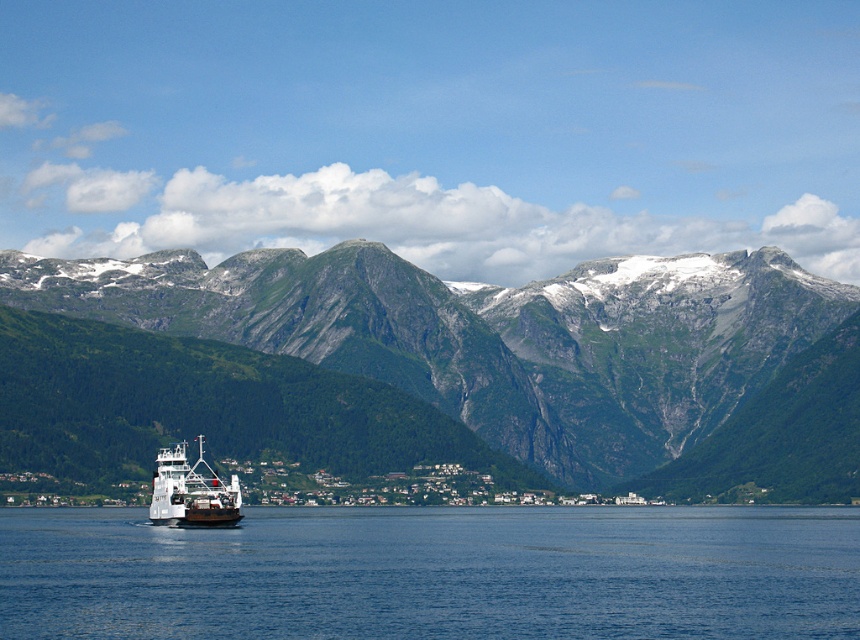
You are standing at the point labeled as point (530,348) in the image. What is the closest major natural feature you can observe around you?

The point (530,348) corresponds to the green rocky mountain range at center, so the closest major natural feature around you is the green rocky mountain range at center.

You are a photographer trying to capture the white matte ferry at lower left and the green rocky mountains at upper center in a single shot. Which object will appear bigger in your photo?

The green rocky mountains at upper center will appear bigger in the photo because they are larger in size than the white matte ferry at lower left.

You are standing on the shore and see the green rocky mountain range at center and the white matte ferry at lower left. Which object is closer to you according to their positions in the image?

The green rocky mountain range at center is closer to you because it is positioned in front of the white matte ferry at lower left in the image.